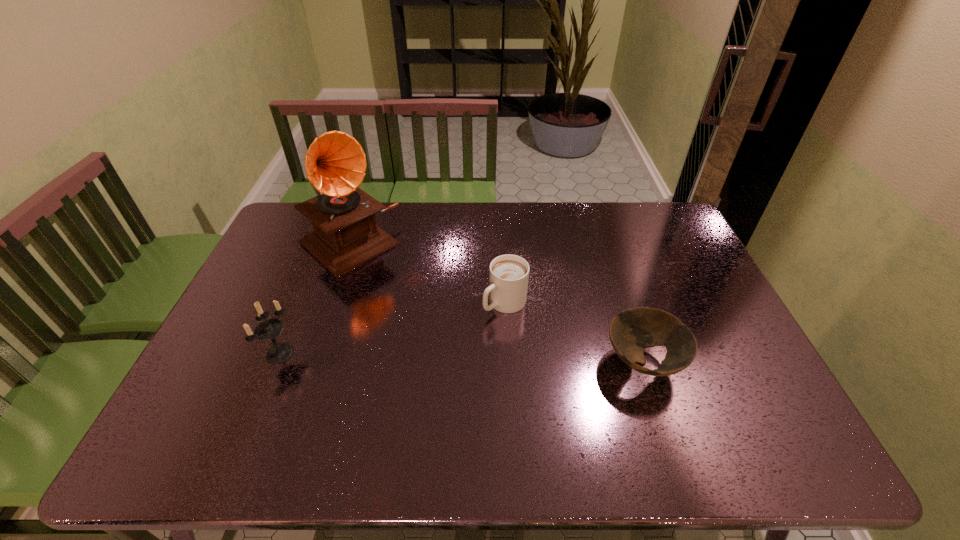
You are a GUI agent. You are given a task and a screenshot of the screen. Output one action in this format:
    pyautogui.click(x=<x>, y=<y>)
    Task: Click on the vacant space located on the side with the handle of the cappuccino
    This screenshot has height=540, width=960.
    Given the screenshot: What is the action you would take?
    click(x=435, y=363)

The width and height of the screenshot is (960, 540). Find the location of `vacant space located 0.220m on the side with the handle of the cappuccino`. vacant space located 0.220m on the side with the handle of the cappuccino is located at coordinates (435, 363).

You are a GUI agent. You are given a task and a screenshot of the screen. Output one action in this format:
    pyautogui.click(x=<x>, y=<y>)
    Task: Click on the free location located 0.150m on the horn of the phonograph record
    This screenshot has height=540, width=960.
    Given the screenshot: What is the action you would take?
    pyautogui.click(x=406, y=292)

Where is `blank area located on the horn of the phonograph record`? blank area located on the horn of the phonograph record is located at coordinates (404, 290).

You are a GUI agent. You are given a task and a screenshot of the screen. Output one action in this format:
    pyautogui.click(x=<x>, y=<y>)
    Task: Click on the vacant position located 0.190m on the horn of the phonograph record
    The height and width of the screenshot is (540, 960).
    Given the screenshot: What is the action you would take?
    pyautogui.click(x=414, y=299)

Where is `object positioned at the far edge`? object positioned at the far edge is located at coordinates (346, 236).

Where is `object that is at the near edge`? object that is at the near edge is located at coordinates (631, 331).

Identify the location of candle holder that is at the left edge. Image resolution: width=960 pixels, height=540 pixels. (268, 329).

Identify the location of phonograph record that is at the left edge. (346, 236).

Where is `object at the far left corner`? The width and height of the screenshot is (960, 540). object at the far left corner is located at coordinates (346, 236).